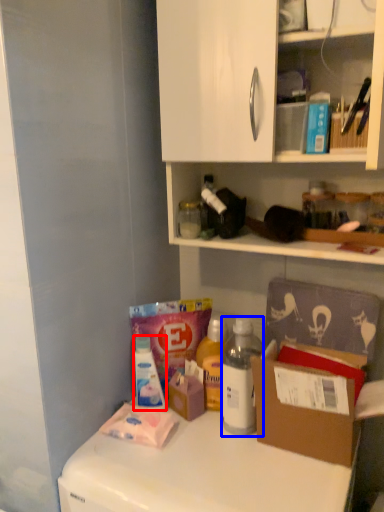
Question: Which of the following is the farthest to the observer, bottle (highlighted by a red box) or bottle (highlighted by a blue box)?

Choices:
 (A) bottle
 (B) bottle

Answer: (A)